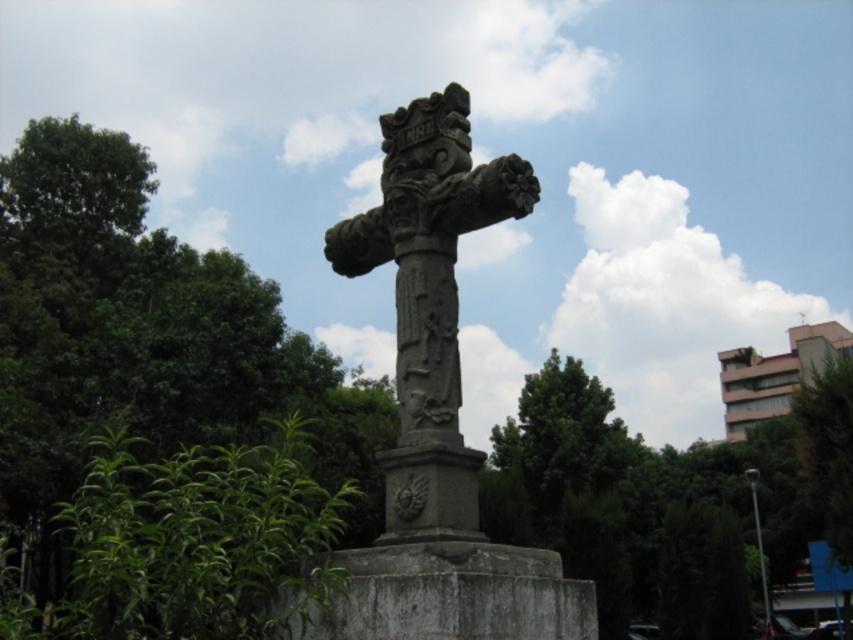
Question: Which point appears closest to the camera in this image?

Choices:
 (A) (434, 266)
 (B) (107, 356)

Answer: (A)

Question: Does green leafy tree at upper left appear over gray stone cross at center?

Choices:
 (A) no
 (B) yes

Answer: (A)

Question: Is green leafy tree at upper left to the right of gray stone cross at center from the viewer's perspective?

Choices:
 (A) no
 (B) yes

Answer: (A)

Question: Among these points, which one is farthest from the camera?

Choices:
 (A) (404, 493)
 (B) (329, 381)

Answer: (B)

Question: Can you confirm if green leafy tree at upper left is positioned above gray stone cross at center?

Choices:
 (A) yes
 (B) no

Answer: (B)